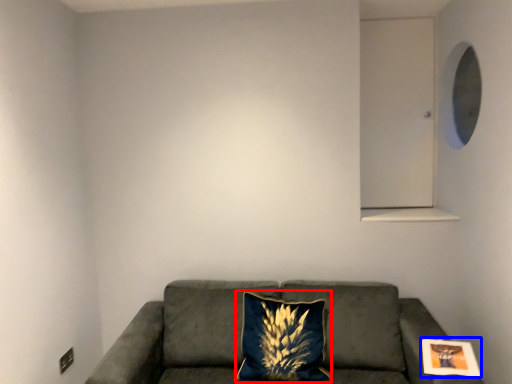
Question: Which of the following is the farthest to the observer, pillow (highlighted by a red box) or picture frame (highlighted by a blue box)?

Choices:
 (A) pillow
 (B) picture frame

Answer: (A)